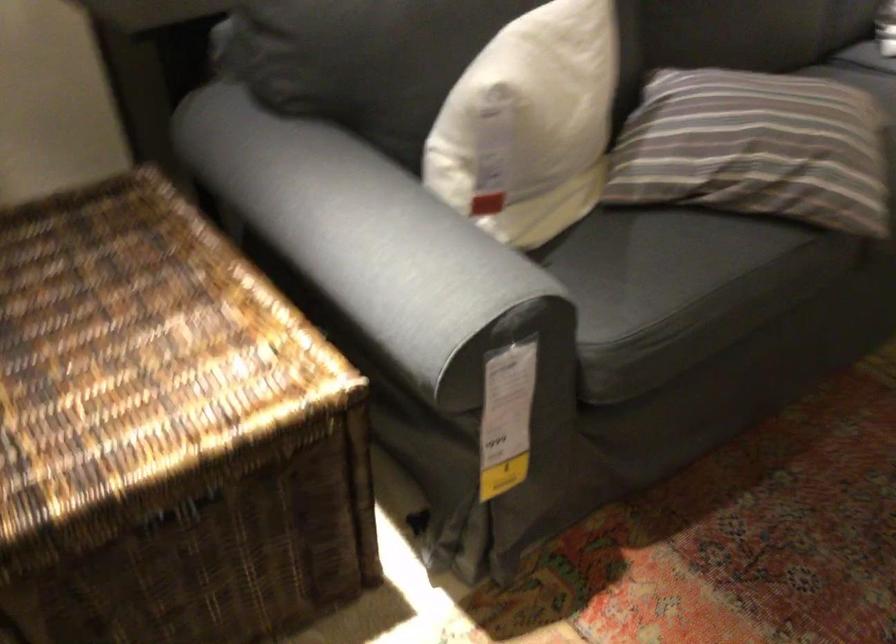
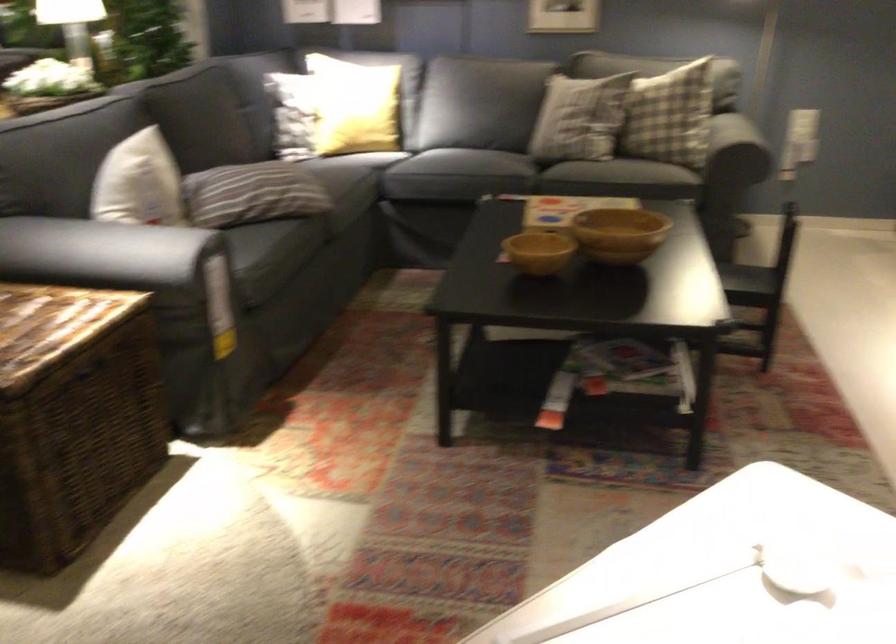
Find the pixel in the second image that matches [478,118] in the first image.

(139, 183)